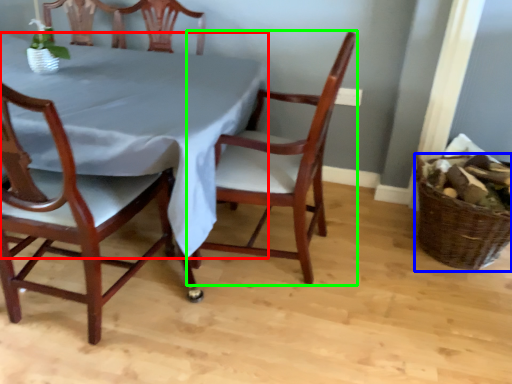
Question: Which is farther away from tablecloth (highlighted by a red box)? basket (highlighted by a blue box) or chair (highlighted by a green box)?

Choices:
 (A) basket
 (B) chair

Answer: (A)